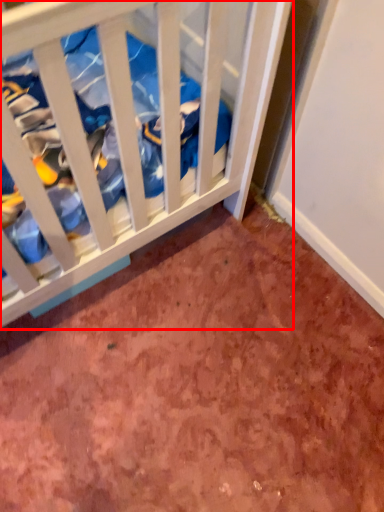
Question: From the image's perspective, what is the correct spatial positioning of infant bed (annotated by the red box) in reference to dirt?

Choices:
 (A) above
 (B) below

Answer: (A)